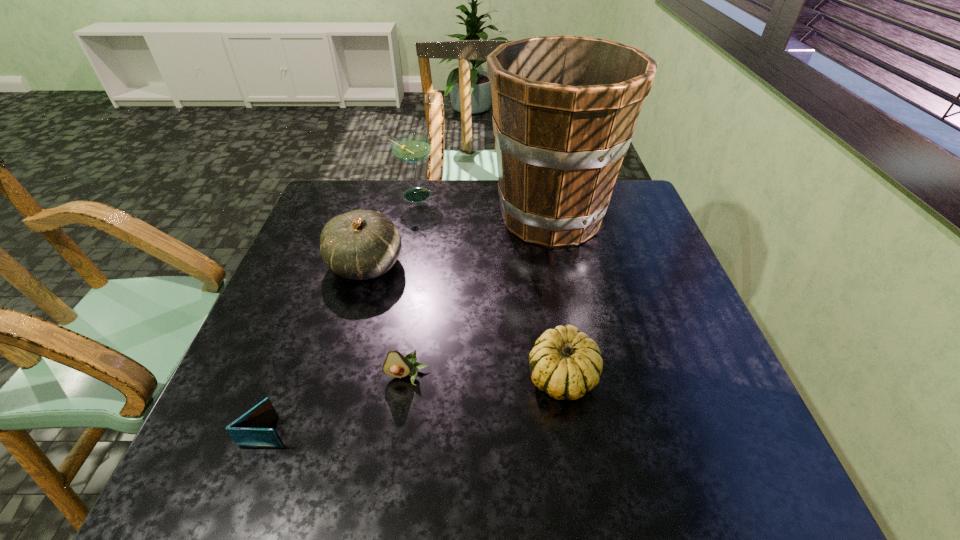
Where is `free area in between the bucket and the shorter gourd`? free area in between the bucket and the shorter gourd is located at coordinates (557, 296).

This screenshot has width=960, height=540. Find the location of `vacant area that lies between the tallest object and the martini`. vacant area that lies between the tallest object and the martini is located at coordinates (483, 206).

Identify the location of empty space that is in between the avocado and the right gourd. The height and width of the screenshot is (540, 960). (485, 376).

At what (x,y) coordinates should I click in order to perform the action: click on free space between the shorter gourd and the shortest object. Please return your answer as a coordinate pair (x, y). This screenshot has height=540, width=960. Looking at the image, I should click on (415, 404).

You are a GUI agent. You are given a task and a screenshot of the screen. Output one action in this format:
    pyautogui.click(x=<x>, y=<y>)
    Task: Click on the blank region between the avocado and the bucket
    The height and width of the screenshot is (540, 960).
    Given the screenshot: What is the action you would take?
    pyautogui.click(x=479, y=296)

Find the location of a particular element. empty location between the fifth tallest object and the wallet is located at coordinates (337, 404).

You are a GUI agent. You are given a task and a screenshot of the screen. Output one action in this format:
    pyautogui.click(x=<x>, y=<y>)
    Task: Click on the empty space between the tallest object and the martini
    The image size is (960, 540).
    Given the screenshot: What is the action you would take?
    pyautogui.click(x=483, y=206)

Locate an element on the screen. vacant point located between the second tallest object and the fourth tallest object is located at coordinates (489, 286).

Where is `vacant area between the nearest object and the taller gourd`? The height and width of the screenshot is (540, 960). vacant area between the nearest object and the taller gourd is located at coordinates (317, 348).

Identify the location of the closest object relative to the shorter gourd. The height and width of the screenshot is (540, 960). (396, 365).